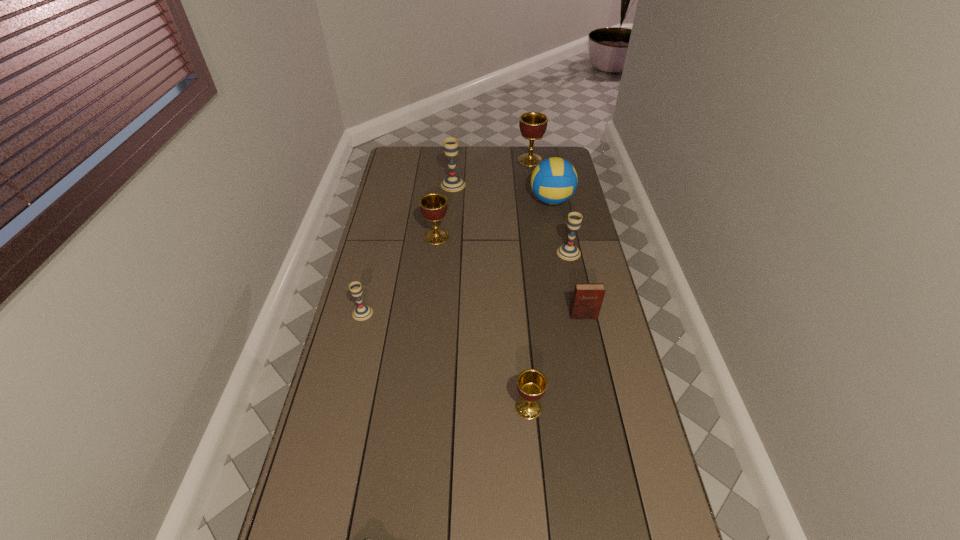
You are a GUI agent. You are given a task and a screenshot of the screen. Output one action in this format:
    pyautogui.click(x=<x>, y=<y>)
    Task: Click on the farthest object
    The height and width of the screenshot is (540, 960).
    Given the screenshot: What is the action you would take?
    [533, 125]

Find the location of a particular element. The height and width of the screenshot is (540, 960). the biggest golden chalice is located at coordinates (533, 125).

Where is `the farthest gray chalice`? the farthest gray chalice is located at coordinates (x=452, y=183).

Locate an element on the screen. the second gray chalice from left to right is located at coordinates (452, 183).

Find the location of a particular element. The image size is (960, 540). blue volleyball is located at coordinates (554, 180).

Find the location of a particular element. This screenshot has height=540, width=960. the second nearest gray chalice is located at coordinates (569, 252).

Where is `the second smallest gray chalice`? Image resolution: width=960 pixels, height=540 pixels. the second smallest gray chalice is located at coordinates (569, 252).

You are a GUI agent. You are given a task and a screenshot of the screen. Output one action in this format:
    pyautogui.click(x=<x>, y=<y>)
    Task: Click on the second biggest golden chalice
    The height and width of the screenshot is (540, 960).
    Given the screenshot: What is the action you would take?
    pyautogui.click(x=433, y=206)

At what (x,y) coordinates should I click in order to perform the action: click on the second farthest golden chalice. Please return your answer as a coordinate pair (x, y). This screenshot has width=960, height=540. Looking at the image, I should click on (433, 206).

Identify the location of reddish-brown diary. (587, 300).